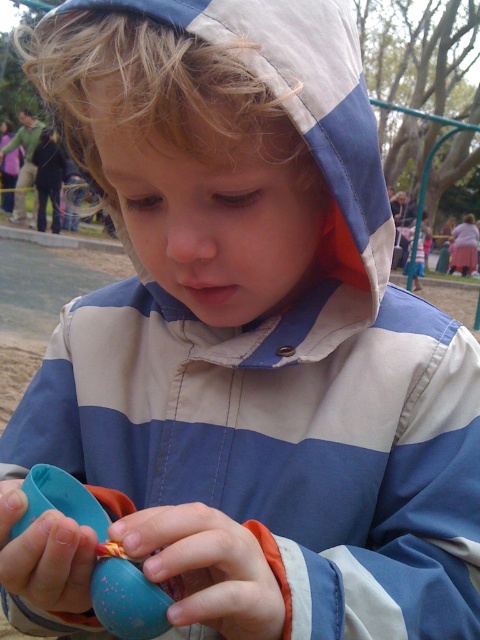
Is blue rubber toy at center above matte plastic egg at center?

Actually, blue rubber toy at center is below matte plastic egg at center.

Does blue rubber toy at center appear on the left side of matte plastic egg at center?

No, blue rubber toy at center is not to the left of matte plastic egg at center.

What do you see at coordinates (206, 568) in the screenshot?
I see `blue rubber toy at center` at bounding box center [206, 568].

Image resolution: width=480 pixels, height=640 pixels. In order to click on blue rubber toy at center in this screenshot , I will do `click(206, 568)`.